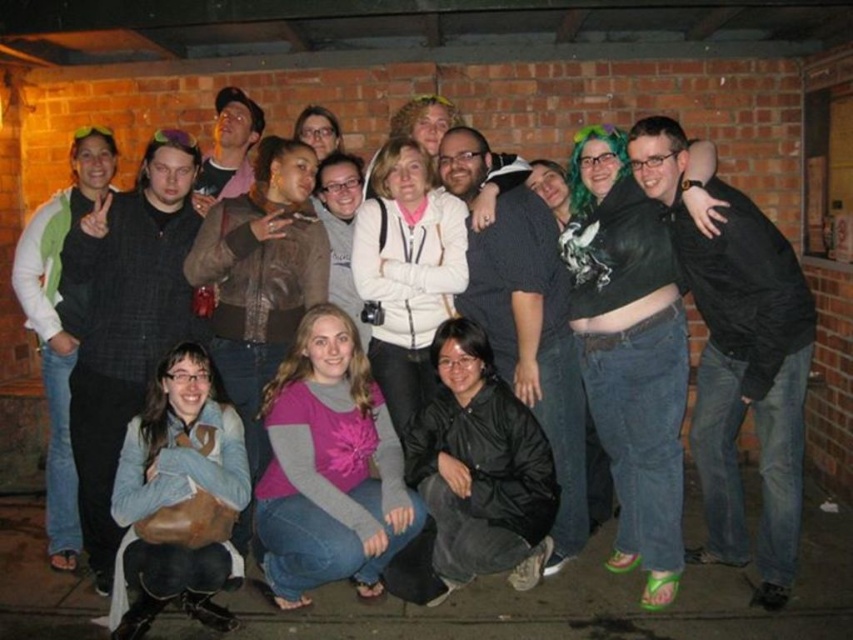
Is green hair at center taller than matte black jacket at center?

Indeed, green hair at center has a greater height compared to matte black jacket at center.

Who is more forward, (579, 288) or (239, 168)?

Point (579, 288)

The image size is (853, 640). In order to click on green hair at center in this screenshot , I will do `click(630, 352)`.

This screenshot has width=853, height=640. What do you see at coordinates (61, 324) in the screenshot?
I see `white fleece jacket at lower left` at bounding box center [61, 324].

Is white fleece jacket at lower left thinner than matte black jacket at center?

Incorrect, white fleece jacket at lower left's width is not less than matte black jacket at center's.

The image size is (853, 640). I want to click on white fleece jacket at lower left, so click(x=61, y=324).

Is point (654, 369) behind point (163, 333)?

No, (654, 369) is in front of (163, 333).

Is green hair at center to the left of matte black jacket at left from the viewer's perspective?

Incorrect, green hair at center is not on the left side of matte black jacket at left.

Who is more forward, (674, 291) or (151, 216)?

Point (674, 291) is in front.

Locate an element on the screen. Image resolution: width=853 pixels, height=640 pixels. green hair at center is located at coordinates (630, 352).